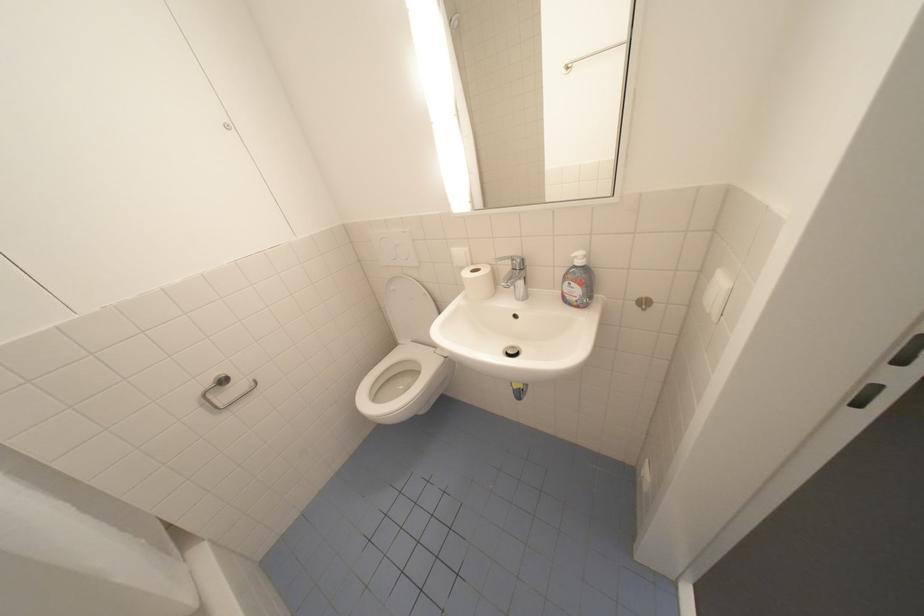
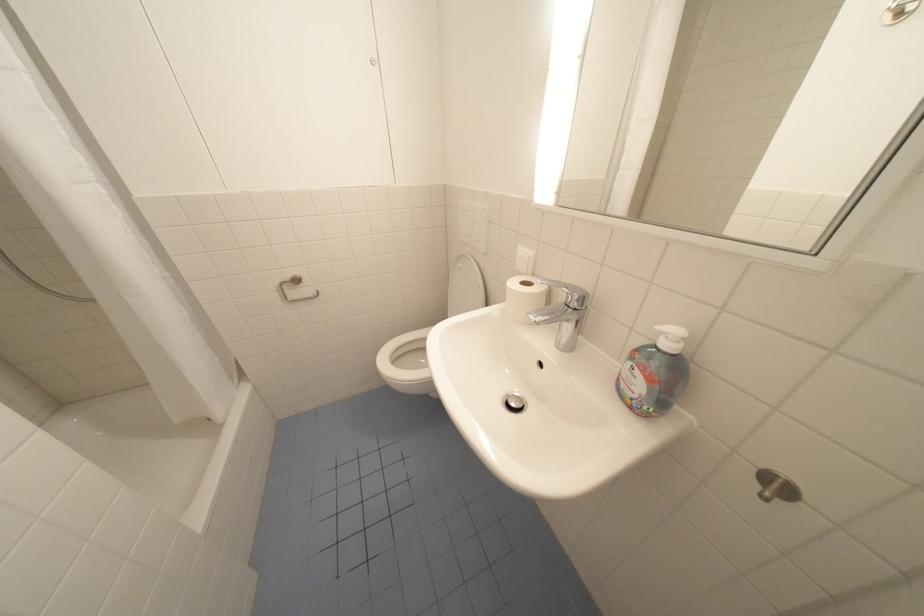
Locate, in the second image, the point that corresponds to the point at 473,276 in the first image.

(520, 284)